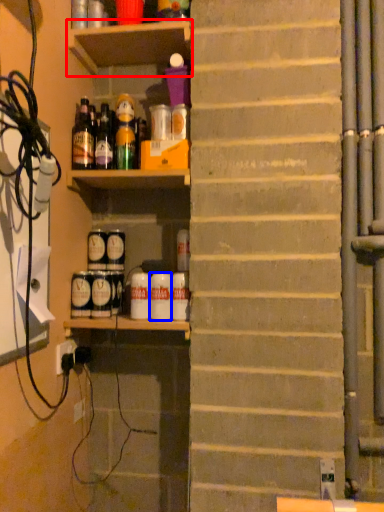
Question: Which point is closer to the camera, shelf (highlighted by a red box) or beverage (highlighted by a blue box)?

Choices:
 (A) shelf
 (B) beverage

Answer: (A)